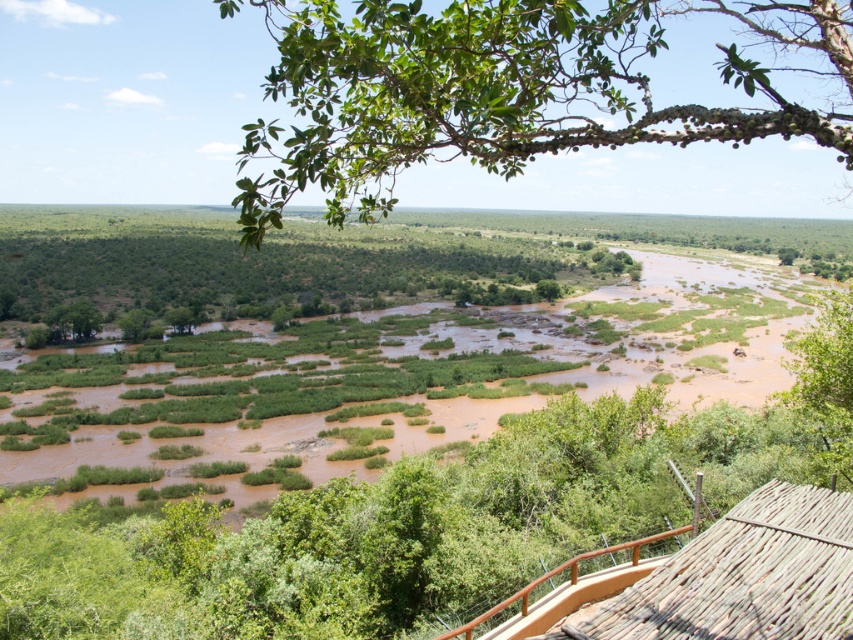
Is thatched wood hut at lower right smaller than brown wood railing at lower right?

Answer: Yes.

Is point (695, 560) positioned behind point (495, 611)?

No, (695, 560) is in front of (495, 611).

The image size is (853, 640). Describe the element at coordinates (746, 577) in the screenshot. I see `thatched wood hut at lower right` at that location.

At what (x,y) coordinates should I click in order to perform the action: click on thatched wood hut at lower right. Please return your answer as a coordinate pair (x, y). This screenshot has height=640, width=853. Looking at the image, I should click on (746, 577).

Does point (418, 120) come closer to viewer compared to point (785, 484)?

Yes.

Who is taller, green leafy branch at upper center or thatched wood hut at lower right?

Standing taller between the two is green leafy branch at upper center.

Does point (502, 152) lie behind point (746, 541)?

That is False.

What are the coordinates of `green leafy branch at upper center` in the screenshot? It's located at (503, 90).

Between green leafy branch at upper center and brown wood railing at lower right, which one has less height?

Standing shorter between the two is brown wood railing at lower right.

Does green leafy branch at upper center have a greater height compared to brown wood railing at lower right?

Correct, green leafy branch at upper center is much taller as brown wood railing at lower right.

Is point (534, 19) farther from camera compared to point (646, 538)?

That is False.

You are a GUI agent. You are given a task and a screenshot of the screen. Output one action in this format:
    pyautogui.click(x=<x>, y=<y>)
    Task: Click on the green leafy branch at upper center
    
    Given the screenshot: What is the action you would take?
    pyautogui.click(x=503, y=90)